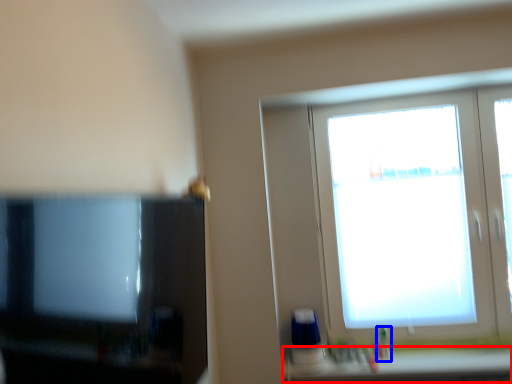
Question: Which of the following is the closest to the observer, window sill (highlighted by a red box) or toiletry (highlighted by a blue box)?

Choices:
 (A) window sill
 (B) toiletry

Answer: (A)